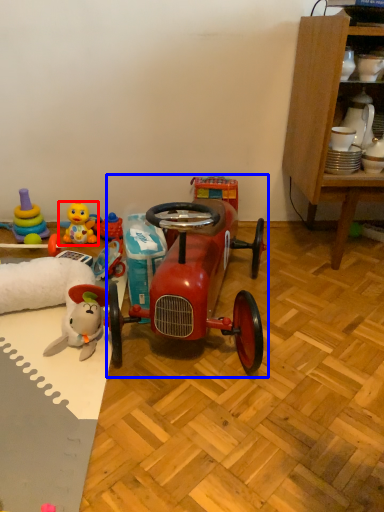
Question: Among these objects, which one is nearest to the camera, toy (highlighted by a red box) or model car (highlighted by a blue box)?

Choices:
 (A) toy
 (B) model car

Answer: (B)